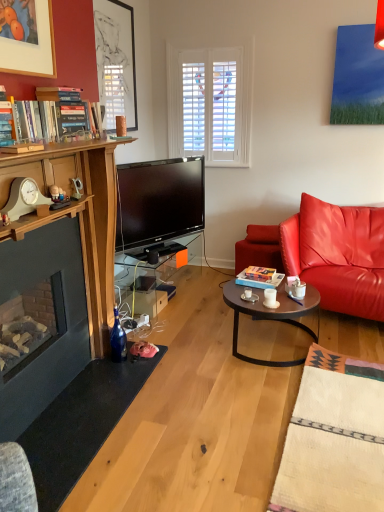
Question: From a real-world perspective, is blue glass bottle at lower left above or below hardcover book at center, the 1th book in the back-to-front sequence?

Choices:
 (A) below
 (B) above

Answer: (A)

Question: Does point (119, 322) appear closer or farther from the camera than point (274, 287)?

Choices:
 (A) farther
 (B) closer

Answer: (B)

Question: Estimate the real-world distances between objects in this image. Which object is closer to the matte silver phone at left?

Choices:
 (A) white wooden clock at left
 (B) hardcover books at left, which appears as the first book when viewed from the left
 (C) wooden round table at center
 (D) blue glass bottle at lower left
 (E) matte black picture frame at upper left

Answer: (A)

Question: Estimate the real-world distances between objects in this image. Which object is farther from the matte silver phone at left?

Choices:
 (A) hardcover book at center, which is the 2th book in left-to-right order
 (B) white ceramic mug at center
 (C) leather cushion at right
 (D) transparent glass table at center
 (E) wooden round table at center

Answer: (C)